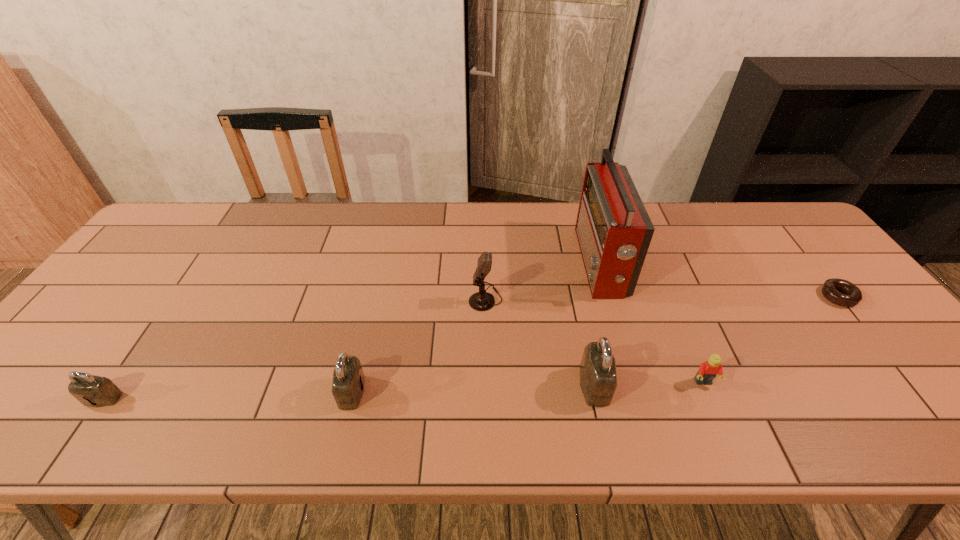
Select which object is the fifth closest to the microphone. Please provide its 2D coordinates. Your answer should be formatted as a tuple, i.e. [(x, y)], where the tuple contains the x and y coordinates of a point satisfying the conditions above.

[(96, 391)]

At what (x,y) coordinates should I click in order to perform the action: click on padlock that is the second closest to the shortest object. Please return your answer as a coordinate pair (x, y). Image resolution: width=960 pixels, height=540 pixels. Looking at the image, I should click on (348, 378).

Select which padlock appears as the second closest to the doughnut. Please provide its 2D coordinates. Your answer should be formatted as a tuple, i.e. [(x, y)], where the tuple contains the x and y coordinates of a point satisfying the conditions above.

[(348, 378)]

I want to click on vacant space that satisfies the following two spatial constraints: 1. at the front of the fourth object from right to left near the keyhole; 2. at the front of the leftmost object near the keyhole, so click(x=597, y=399).

Find the location of `free space that satisfies the following two spatial constraints: 1. at the front of the second tallest padlock near the keyhole; 2. at the front of the shortest padlock near the keyhole`. free space that satisfies the following two spatial constraints: 1. at the front of the second tallest padlock near the keyhole; 2. at the front of the shortest padlock near the keyhole is located at coordinates [350, 399].

Identify the location of vacant position in the image that satisfies the following two spatial constraints: 1. on the front-facing side of the tallest object; 2. at the front of the leftmost object near the keyhole. (639, 399).